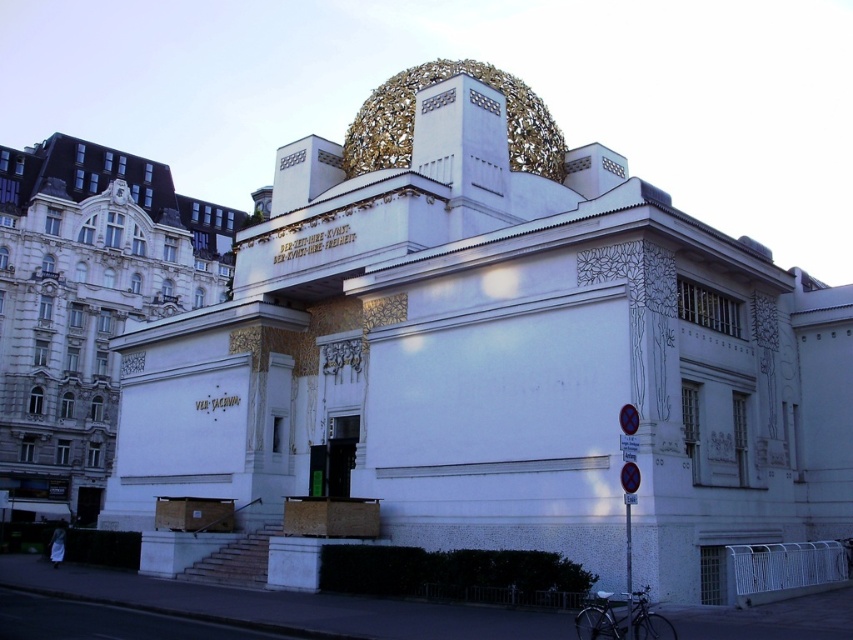
Does point (628, 637) come farther from viewer compared to point (628, 506)?

That is False.

Can you confirm if metallic blue sign at lower right is bigger than metallic pole at center?

Indeed, metallic blue sign at lower right has a larger size compared to metallic pole at center.

Is point (625, 582) in front of point (627, 625)?

That is False.

At what (x,y) coordinates should I click in order to perform the action: click on metallic blue sign at lower right. Please return your answer as a coordinate pair (x, y). Looking at the image, I should click on (628, 522).

Is point (12, 298) farther from viewer compared to point (641, 627)?

That is True.

Does white stone building at lower left appear under silver metallic bicycle at lower right?

Incorrect, white stone building at lower left is not positioned below silver metallic bicycle at lower right.

Find the location of a particular element. white stone building at lower left is located at coordinates pos(86,305).

This screenshot has width=853, height=640. Find the location of `white stone building at lower left`. white stone building at lower left is located at coordinates (86, 305).

Who is positioned more to the left, silver metallic bicycle at lower right or metallic pole at center?

silver metallic bicycle at lower right

Can you confirm if silver metallic bicycle at lower right is smaller than metallic pole at center?

Yes, silver metallic bicycle at lower right is smaller than metallic pole at center.

Is point (628, 627) farther from viewer compared to point (630, 532)?

No, (628, 627) is in front of (630, 532).

You are a GUI agent. You are given a task and a screenshot of the screen. Output one action in this format:
    pyautogui.click(x=<x>, y=<y>)
    Task: Click on the silver metallic bicycle at lower right
    
    Given the screenshot: What is the action you would take?
    pyautogui.click(x=621, y=618)